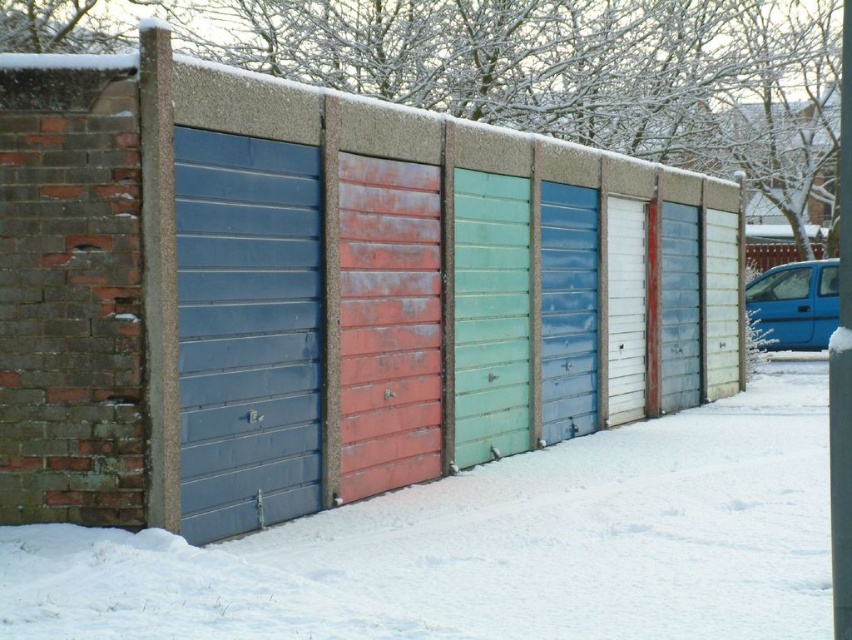
From the picture: You are a delivery person trying to deliver a package to the matte blue metal door at left. You notice the white powdery snow at lower center in front of it. Will you need to clear the snow before placing the package there?

The white powdery snow at lower center is not as tall as the matte blue metal door at left, meaning the snow is lower in height. Since the snow is at the lower center, it might be covering the ground in front of the door. However, the snow being shorter than the door suggests it doesn not block the door itself. Therefore, you can place the package on the ground in front of the matte blue metal door at left without needing to clear the snow, as the snow is not obstructing the delivery area.

You are standing in front of the row of storage units and need to locate the matte blue metal door at left. What are the coordinates where you should look to find it?

The matte blue metal door at left is located at coordinates point (246, 332).